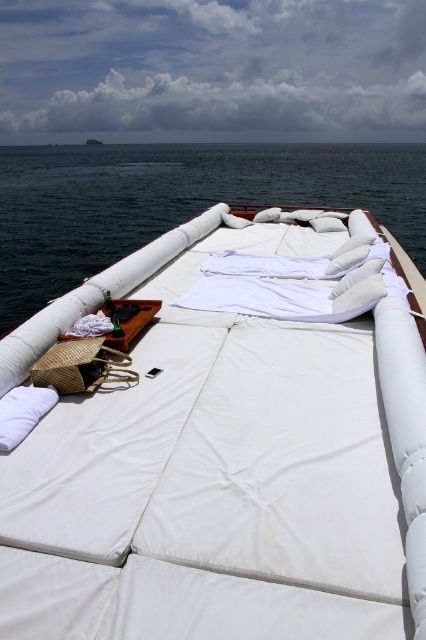
You are lying on the white fabric bed at center and want to look at the dark blue water at center. Which direction should you move to get a better view?

Since the white fabric bed at center is closer to the viewer than the dark blue water at center, you should move forward to get a better view of the dark blue water at center.

You are standing on the deck of a boat and want to reach the dark blue water at center. The white fabric bed at center is in your way. Can you walk around it? Please explain your reasoning.

The white fabric bed at center is 13.73 meters away from the dark blue water at center. Since the distance between them is quite large, you can easily walk around the white fabric bed at center to reach the dark blue water at center.